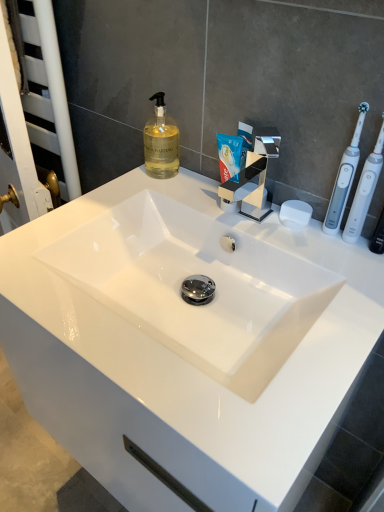
Where is `vacant area that lies between translucent glass soap dispenser at upper center and chrome metallic tap at center`? The width and height of the screenshot is (384, 512). vacant area that lies between translucent glass soap dispenser at upper center and chrome metallic tap at center is located at coordinates pos(193,197).